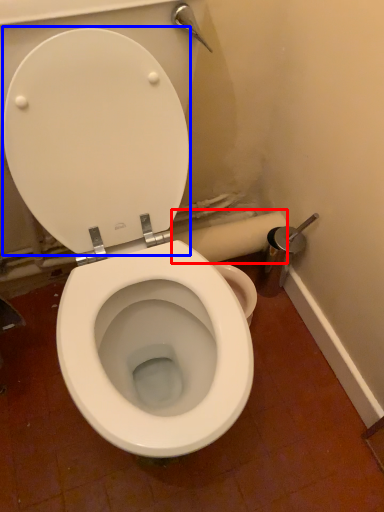
Question: Which of the following is the closest to the observer, toilet paper (highlighted by a red box) or back (highlighted by a blue box)?

Choices:
 (A) toilet paper
 (B) back

Answer: (B)